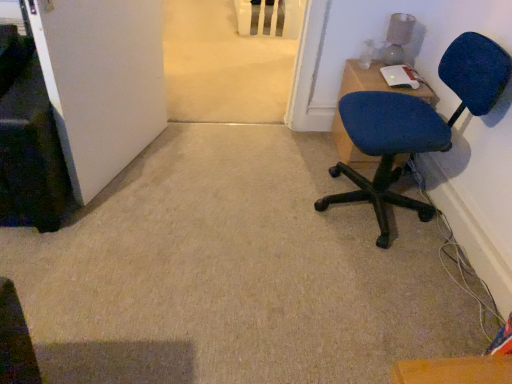
Locate an element on the screen. The image size is (512, 384). free space between white matte door at lower left and blue fabric chair at upper right is located at coordinates (221, 159).